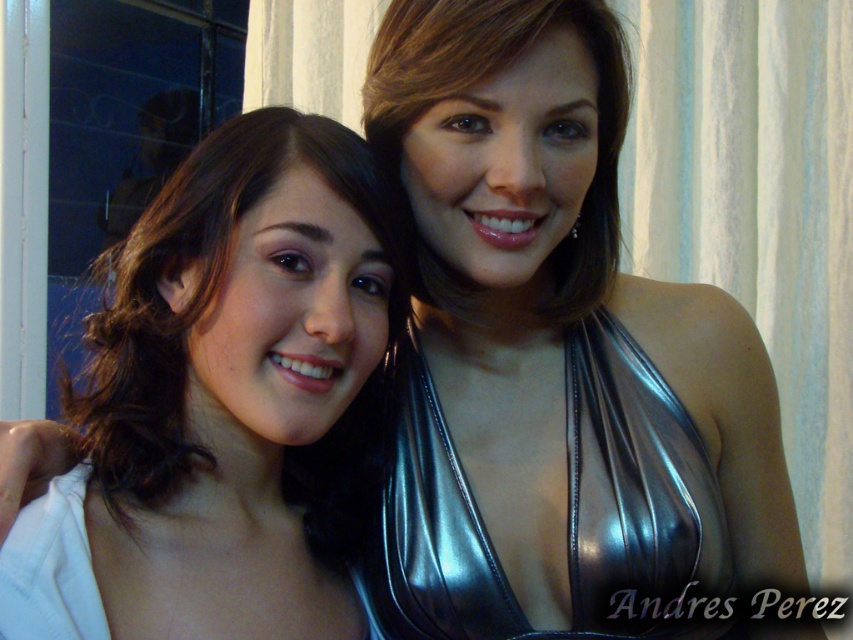
You are standing in front of the two people in the photo and want to place a small gift between them. The gift must be placed exactly at the point that is closer to the person on the right. Which point should you choose between point 1 at coordinate (334,634) and point 2 at coordinate (512,600)?

Point 1 at coordinate (334,634) is closer to the person on the right, so you should place the gift there.

You are a photographer trying to adjust the lighting for a photo shoot. You notice the matte black hair at center and the shiny black dress at center. Which object might require more careful lighting to avoid overexposure?

The shiny black dress at center might require more careful lighting to avoid overexposure because it reflects light more than the matte black hair at center, which is thinner and less likely to catch excessive light.

You are a photographer adjusting the lighting for a portrait. You notice a point at coordinates (223, 404) in the image. Based on the scene, where is this point located?

The point at coordinates (223, 404) is located on the matte black hair at center.